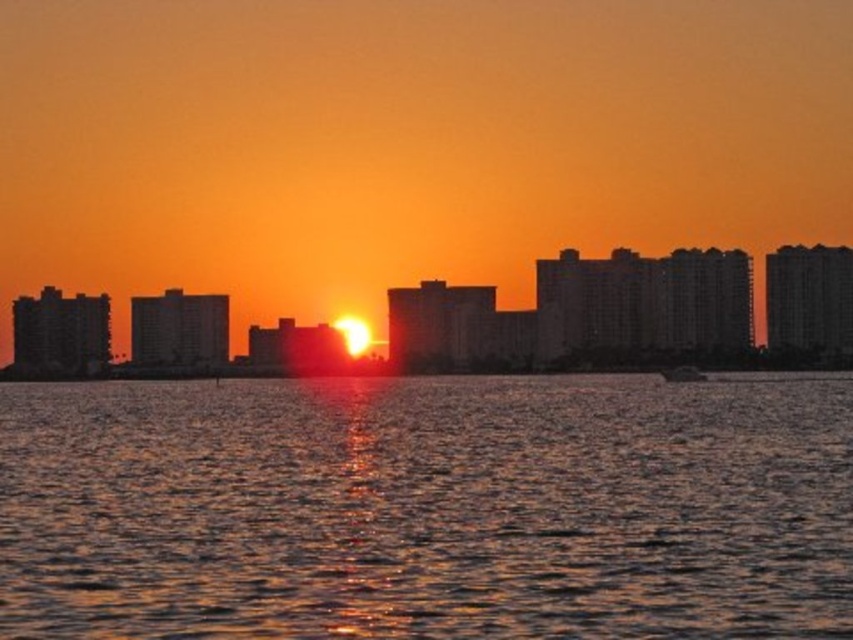
Question: Which of these objects is positioned farthest from the glistening water at center?

Choices:
 (A) silky water at center
 (B) metallic silver boat at center

Answer: (B)

Question: Which object is positioned closest to the metallic silver boat at center?

Choices:
 (A) silky water at center
 (B) glistening water at center

Answer: (A)

Question: Is the position of glistening water at center less distant than that of metallic silver boat at center?

Choices:
 (A) yes
 (B) no

Answer: (A)

Question: Which object appears closest to the camera in this image?

Choices:
 (A) metallic silver boat at center
 (B) silky water at center

Answer: (B)

Question: Can you confirm if glistening water at center is wider than silky water at center?

Choices:
 (A) yes
 (B) no

Answer: (B)

Question: Does glistening water at center appear under silky water at center?

Choices:
 (A) no
 (B) yes

Answer: (B)